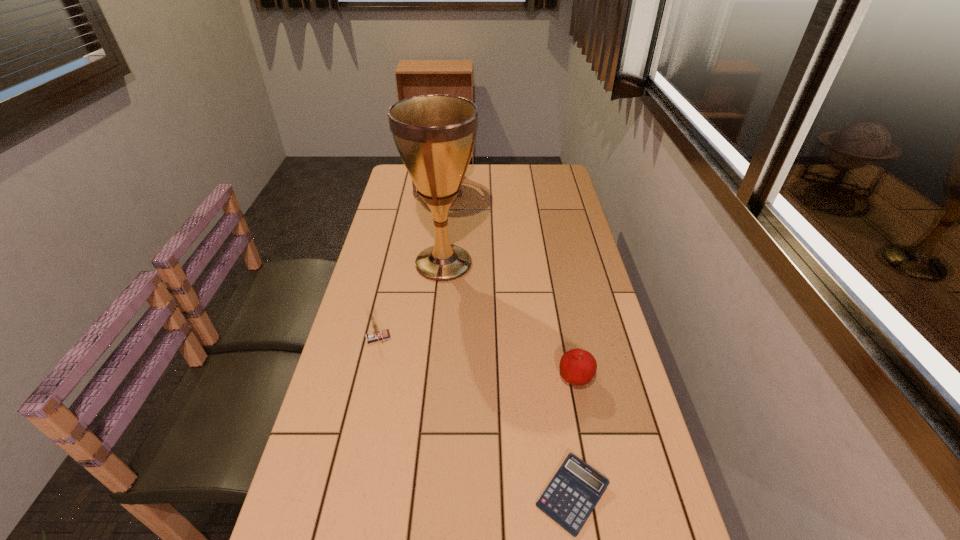
This screenshot has width=960, height=540. In order to click on vacant space situated on the back of the second farthest object in this screenshot , I will do `click(449, 200)`.

I want to click on vacant area situated 0.220m on the front-facing side of the globe, so click(x=432, y=235).

This screenshot has height=540, width=960. Identify the location of vacant point located 0.090m on the right of the third tallest object. (423, 338).

Locate an element on the screen. Image resolution: width=960 pixels, height=540 pixels. vacant region located 0.080m on the back of the fourth farthest object is located at coordinates (567, 342).

I want to click on free spot located on the right of the nearest object, so 660,495.

Locate an element on the screen. object at the far edge is located at coordinates (415, 194).

Where is `trophy cup situated at the left edge`? The image size is (960, 540). trophy cup situated at the left edge is located at coordinates (435, 135).

You are a GUI agent. You are given a task and a screenshot of the screen. Output one action in this format:
    pyautogui.click(x=<x>, y=<y>)
    Task: Click on the globe that is at the left edge
    
    Given the screenshot: What is the action you would take?
    pyautogui.click(x=415, y=194)

Identify the location of matchbox at the left edge. The image size is (960, 540). (376, 335).

At what (x,y) coordinates should I click in order to perform the action: click on apple that is at the right edge. Please return your answer as a coordinate pair (x, y). Looking at the image, I should click on (577, 367).